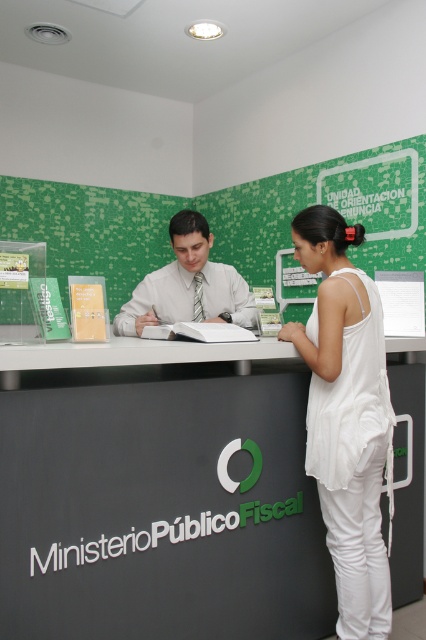
Does matte black desk at center lie in front of white shirt at center?

Yes, it is.

Between matte black desk at center and white shirt at center, which one is positioned higher?

white shirt at center is higher up.

At what (x,y) coordinates should I click in order to perform the action: click on matte black desk at center. Please return your answer as a coordinate pair (x, y). The image size is (426, 640). Looking at the image, I should click on (160, 496).

Is matte black desk at center further to camera compared to white cotton tank top at center?

No.

Locate an element on the screen. Image resolution: width=426 pixels, height=640 pixels. matte black desk at center is located at coordinates (160, 496).

Is white cotton tank top at center taller than white shirt at center?

Correct, white cotton tank top at center is much taller as white shirt at center.

Can you confirm if white cotton tank top at center is positioned to the left of white shirt at center?

In fact, white cotton tank top at center is to the right of white shirt at center.

Is point (367, 604) less distant than point (203, 285)?

Yes, it is in front of point (203, 285).

Where is `white cotton tank top at center`? This screenshot has width=426, height=640. white cotton tank top at center is located at coordinates (347, 417).